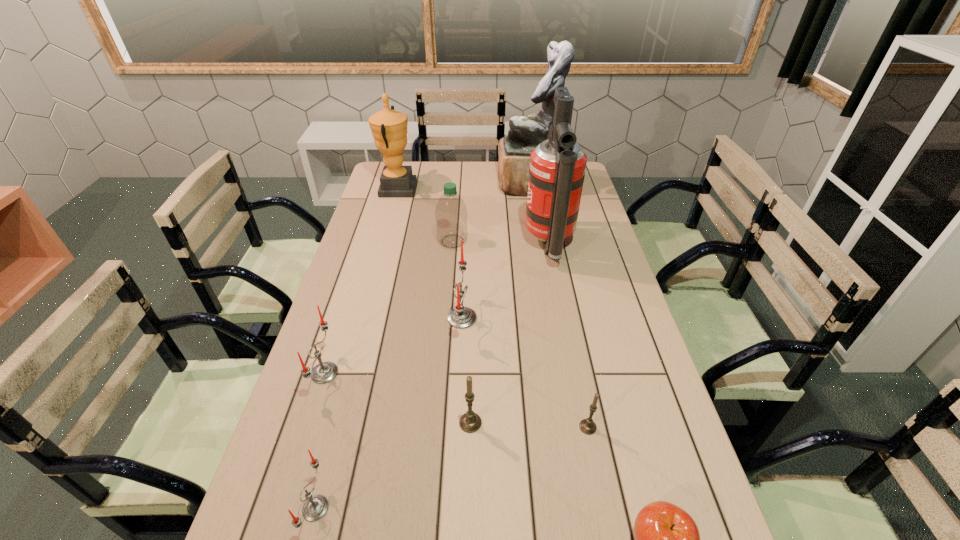
Locate which object is the sixth closest to the fire extinguisher. Please provide its 2D coordinates. Your answer should be formatted as a tuple, i.e. [(x, y)], where the tuple contains the x and y coordinates of a point satisfying the conditions above.

[(470, 422)]

The image size is (960, 540). I want to click on candle that stands as the closest to the left gray candle, so click(x=460, y=317).

You are a GUI agent. You are given a task and a screenshot of the screen. Output one action in this format:
    pyautogui.click(x=<x>, y=<y>)
    Task: Click on the candle that can be found as the closest to the red fire extinguisher
    The height and width of the screenshot is (540, 960).
    Given the screenshot: What is the action you would take?
    pyautogui.click(x=460, y=317)

Locate which red candle is the closest to the apple. Please provide its 2D coordinates. Your answer should be formatted as a tuple, i.e. [(x, y)], where the tuple contains the x and y coordinates of a point satisfying the conditions above.

[(460, 317)]

Identify the location of the second closest red candle to the bigger gray candle. (315, 507).